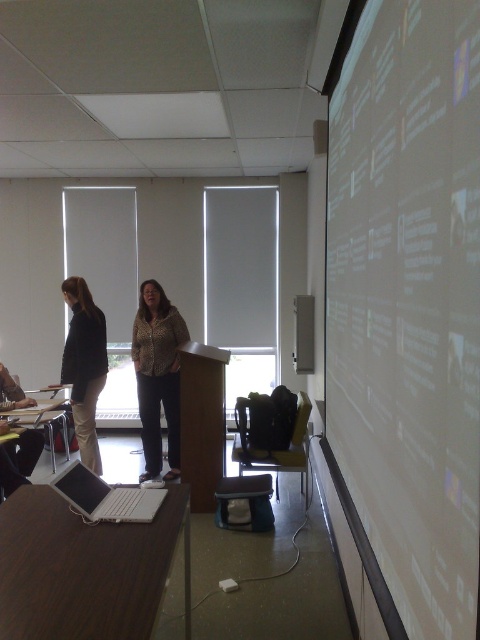
Between matte black jacket at left and white plastic laptop at lower left, which one is positioned higher?

matte black jacket at left is above.

What are the coordinates of `matte black jacket at left` in the screenshot? It's located at (84, 365).

Is point (137, 337) farther from camera compared to point (97, 492)?

Yes, it is.

Between point (142, 285) and point (86, 476), which one is positioned behind?

The point (142, 285) is more distant.

Identify the location of leopard print jacket at center. The height and width of the screenshot is (640, 480). (157, 376).

Is point (363, 444) less distant than point (119, 518)?

No.

Between white matte projector screen at right and white plastic laptop at lower left, which one is positioned higher?

white matte projector screen at right

Is point (376, 451) positioned in front of point (94, 509)?

Yes.

Find the location of a particular element. white matte projector screen at right is located at coordinates (408, 301).